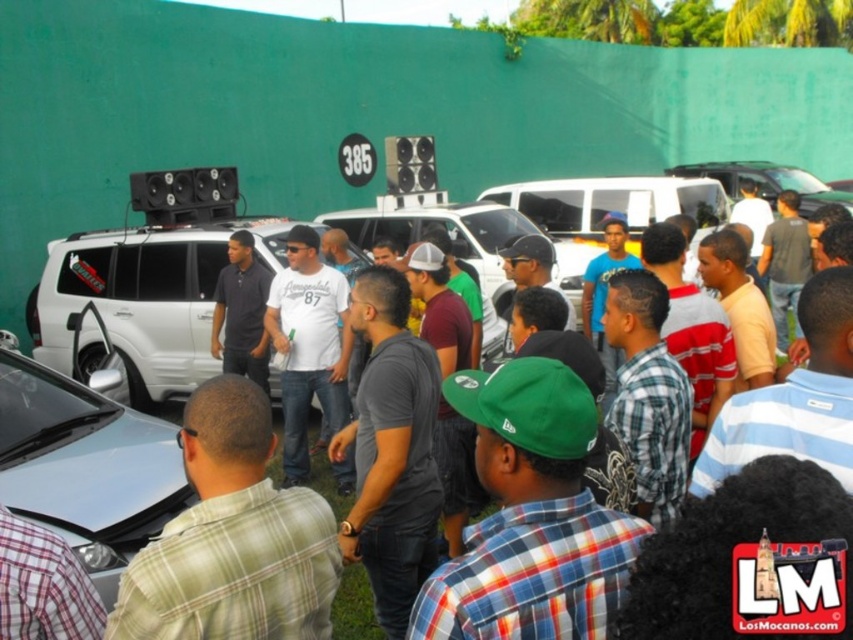
Is white matte suv at upper left positioned in front of dark gray shirt at center?

Yes, it is in front of dark gray shirt at center.

Is point (460, 248) less distant than point (256, 349)?

No, it is behind (256, 349).

Find the location of a particular element. The image size is (853, 640). white matte suv at upper left is located at coordinates (354, 609).

Is point (532, 573) farther from camera compared to point (271, 337)?

No, it is in front of (271, 337).

Is the position of green fabric cap at center more distant than that of white matte shirt at center?

No, it is not.

Where is `green fabric cap at center`? This screenshot has width=853, height=640. green fabric cap at center is located at coordinates (531, 516).

Is green fabric cap at center positioned in front of white matte suv at upper left?

Yes, green fabric cap at center is closer to the viewer.

You are a GUI agent. You are given a task and a screenshot of the screen. Output one action in this format:
    pyautogui.click(x=<x>, y=<y>)
    Task: Click on the green fabric cap at center
    The image size is (853, 640).
    Given the screenshot: What is the action you would take?
    pyautogui.click(x=531, y=516)

What do you see at coordinates (531, 516) in the screenshot? The width and height of the screenshot is (853, 640). I see `green fabric cap at center` at bounding box center [531, 516].

This screenshot has width=853, height=640. I want to click on green fabric cap at center, so click(531, 516).